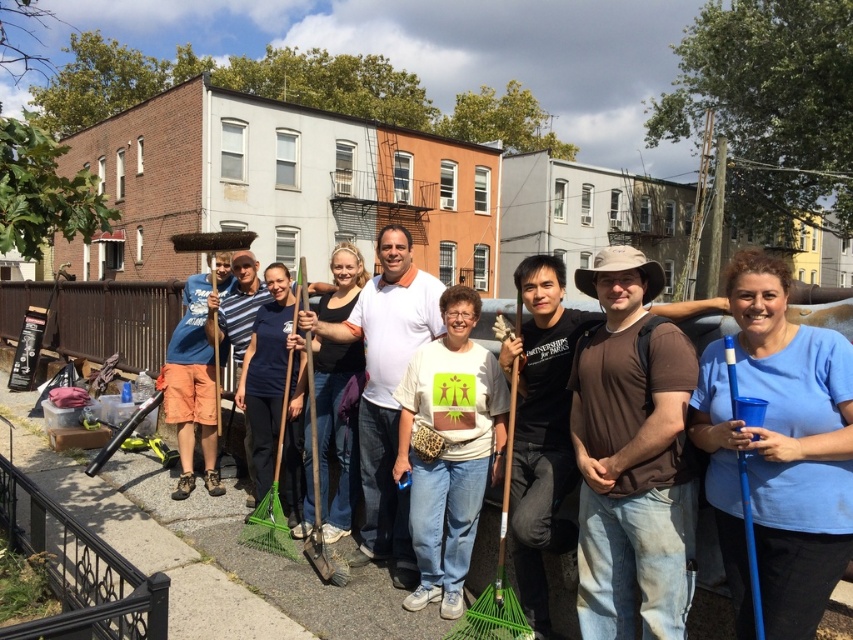
Between blue matte shirt at center and white t-shirt at center, which one appears on the right side from the viewer's perspective?

From the viewer's perspective, blue matte shirt at center appears more on the right side.

Can you confirm if blue matte shirt at center is positioned above white t-shirt at center?

Yes.

In order to click on blue matte shirt at center in this screenshot , I will do `click(779, 451)`.

Find the location of a particular element. This screenshot has width=853, height=640. blue matte shirt at center is located at coordinates (779, 451).